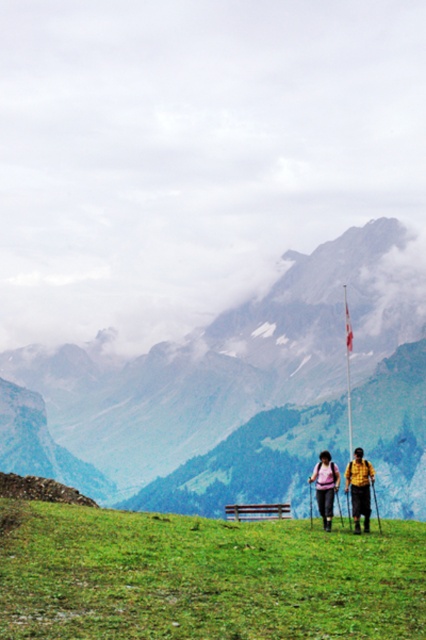
Which is below, pink fabric backpack at center or white fabric flag at center?

pink fabric backpack at center is lower down.

Can you confirm if pink fabric backpack at center is thinner than white fabric flag at center?

Correct, pink fabric backpack at center's width is less than white fabric flag at center's.

Is point (316, 488) farther from camera compared to point (347, 310)?

That is False.

Image resolution: width=426 pixels, height=640 pixels. In order to click on pink fabric backpack at center in this screenshot , I will do `click(325, 486)`.

Which is more to the right, green grassy field at center or yellow fabric jacket at center?

From the viewer's perspective, yellow fabric jacket at center appears more on the right side.

Does green grassy field at center have a larger size compared to yellow fabric jacket at center?

Correct, green grassy field at center is larger in size than yellow fabric jacket at center.

Is point (261, 572) positioned behind point (365, 490)?

That is False.

Identify the location of green grassy field at center. This screenshot has height=640, width=426. (204, 577).

Who is more distant from viewer, (304,257) or (325,509)?

Positioned behind is point (304,257).

Between rocky mountain at center and pink fabric backpack at center, which one has more height?

rocky mountain at center

Where is `rocky mountain at center`? rocky mountain at center is located at coordinates (244, 392).

Find the location of a particular element. Image resolution: width=426 pixels, height=640 pixels. rocky mountain at center is located at coordinates (244, 392).